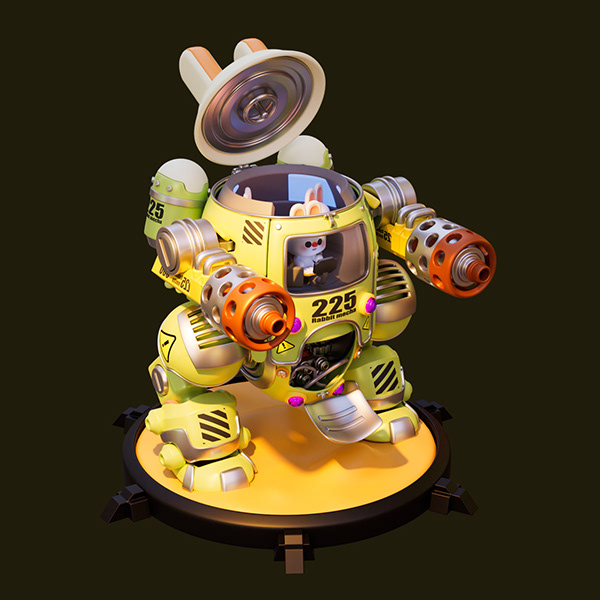
You are a GUI agent. You are given a task and a screenshot of the screen. Output one action in this format:
    pyautogui.click(x=<x>, y=<y>)
    Task: Click on the yellow pad
    
    Given the screenshot: What is the action you would take?
    pyautogui.click(x=305, y=460)